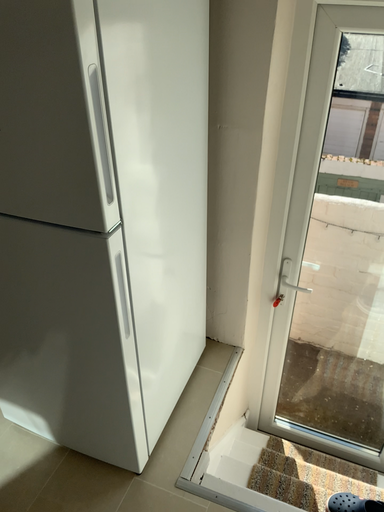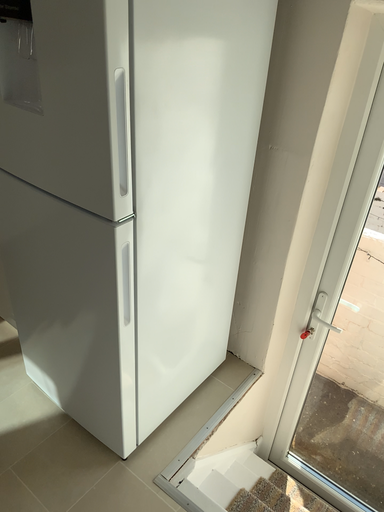
Question: How did the camera likely rotate when shooting the video?

Choices:
 (A) rotated right
 (B) rotated left

Answer: (B)